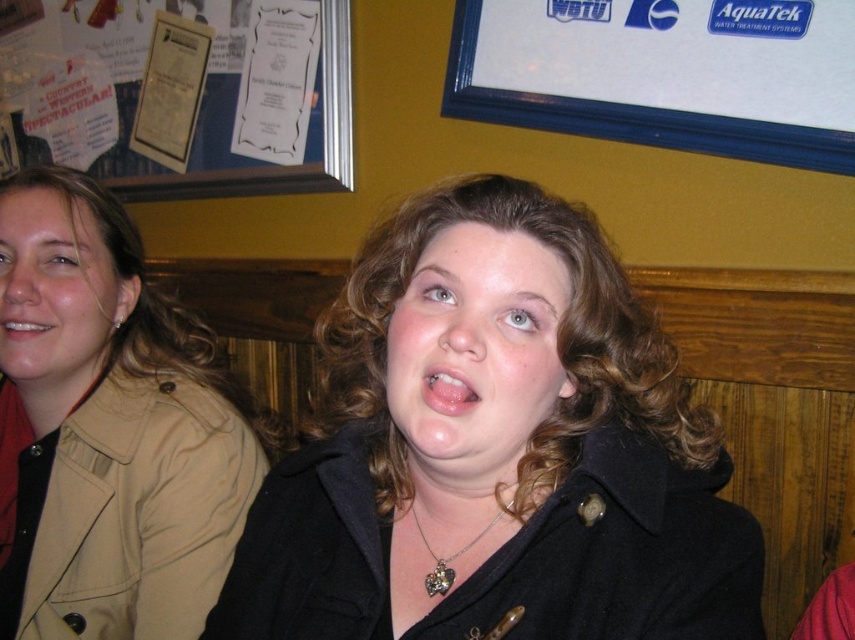
You are standing in the same room as the two people in the image. You want to place a small plant between the two points marked as point (411, 294) and point (450, 394). Which point should the plant be closer to if it needs to be placed in front of the person in the foreground?

The plant should be closer to point (450, 394) because point (411, 294) is behind point (450, 394), so placing it near the front point ensures visibility to the foreground person.

You are a photographer trying to position a spotlight exactly at the center of the matte black coat at center. According to the coordinates provided, where should you aim the spotlight?

The spotlight should be aimed at the coordinates point (476, 349) where the matte black coat at center is located.